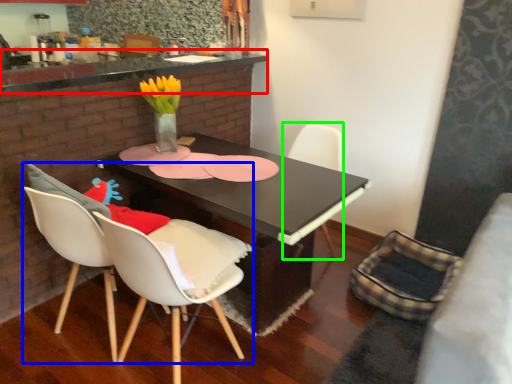
Question: Which object is positioned closest to counter top (highlighted by a red box)? Select from chair (highlighted by a blue box) and chair (highlighted by a green box).

Choices:
 (A) chair
 (B) chair

Answer: (A)